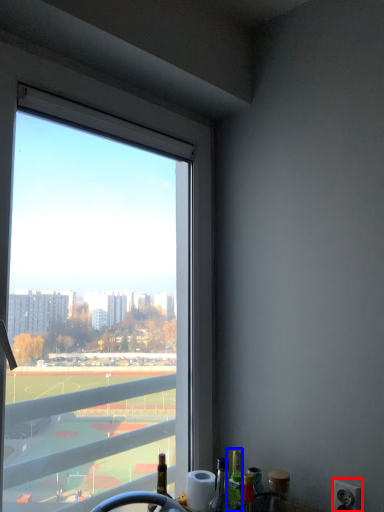
Question: Which object appears farthest to the camera in this image, power outlet (highlighted by a red box) or bottle (highlighted by a blue box)?

Choices:
 (A) power outlet
 (B) bottle

Answer: (B)